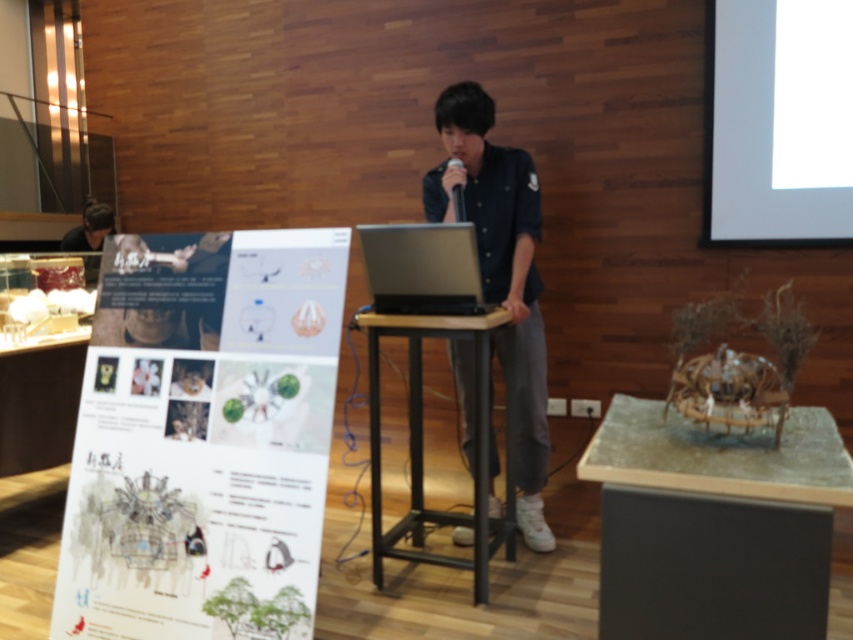
Describe the element at coordinates (202, 436) in the screenshot. The width and height of the screenshot is (853, 640). I see `white paper poster at left` at that location.

Which is in front, point (120, 522) or point (357, 227)?

Positioned in front is point (120, 522).

Where is `white paper poster at left`? white paper poster at left is located at coordinates [x=202, y=436].

Who is more forward, [183,458] or [503,276]?

Point [183,458] is in front.

Is white paper poster at left wider than black matte shirt at center?

Yes, white paper poster at left is wider than black matte shirt at center.

What do you see at coordinates (202, 436) in the screenshot? I see `white paper poster at left` at bounding box center [202, 436].

This screenshot has width=853, height=640. In order to click on white paper poster at left in this screenshot , I will do `click(202, 436)`.

Can you confirm if translucent glass table at center is positioned to the left of satin black laptop at center?

No, translucent glass table at center is not to the left of satin black laptop at center.

Which of these two, translucent glass table at center or satin black laptop at center, stands shorter?

satin black laptop at center

Where is `translucent glass table at center`? This screenshot has width=853, height=640. translucent glass table at center is located at coordinates (714, 524).